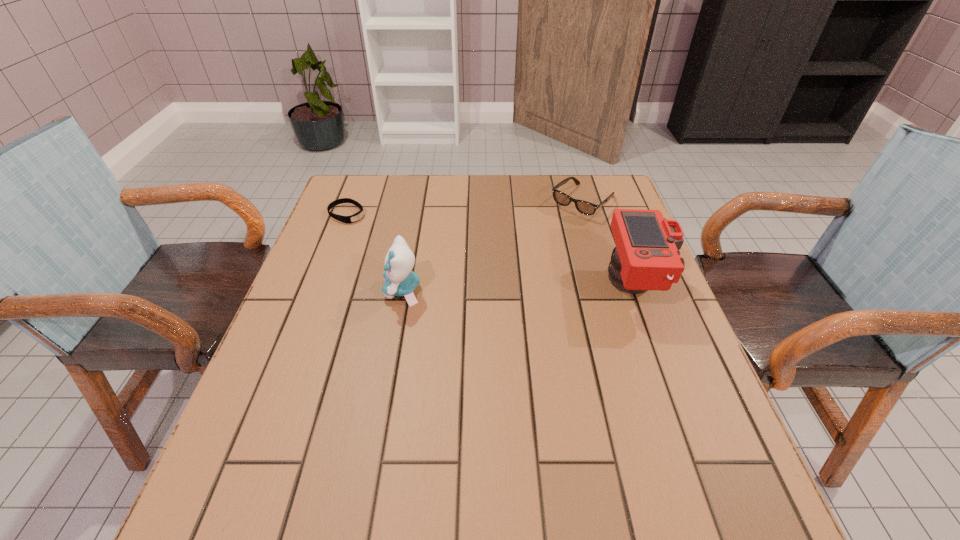
What are the coordinates of `free space located 0.330m on the lenses of the spectacles` in the screenshot? It's located at (500, 279).

Where is `free space located 0.260m on the lenses of the spectacles`? This screenshot has width=960, height=540. free space located 0.260m on the lenses of the spectacles is located at coordinates (516, 265).

Image resolution: width=960 pixels, height=540 pixels. In order to click on free region located on the display of the shortest object in this screenshot , I will do pyautogui.click(x=461, y=274).

The height and width of the screenshot is (540, 960). Find the location of `blank area located on the display of the shortest object`. blank area located on the display of the shortest object is located at coordinates (431, 258).

In order to click on vacant area situated 0.110m on the display of the shortest object in this screenshot , I will do `click(386, 234)`.

Where is `spectacles that is at the far edge`? spectacles that is at the far edge is located at coordinates (584, 207).

At what (x,y) coordinates should I click in order to perform the action: click on wristband located at the far edge. Please return your answer as a coordinate pair (x, y). Image resolution: width=960 pixels, height=540 pixels. Looking at the image, I should click on (357, 216).

The width and height of the screenshot is (960, 540). Find the location of `object that is at the left edge`. object that is at the left edge is located at coordinates (357, 216).

In order to click on camera that is at the right edge in this screenshot , I will do pos(646,257).

In order to click on spectacles positioned at the right edge in this screenshot , I will do pos(584,207).